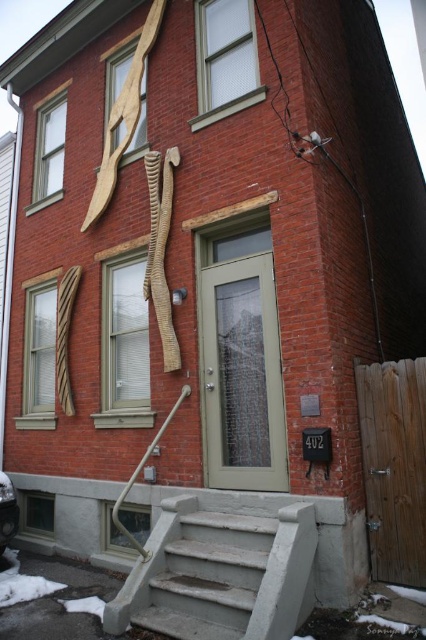
Question: Does concrete steps at center have a larger size compared to brushed metal handrail at lower center?

Choices:
 (A) yes
 (B) no

Answer: (B)

Question: Among these points, which one is farthest from the camera?

Choices:
 (A) (164, 513)
 (B) (186, 387)

Answer: (B)

Question: Which point is farther to the camera?

Choices:
 (A) concrete steps at center
 (B) brushed metal handrail at lower center

Answer: (B)

Question: Does concrete steps at center have a larger size compared to brushed metal handrail at lower center?

Choices:
 (A) no
 (B) yes

Answer: (A)

Question: Where is concrete steps at center located in relation to brushed metal handrail at lower center in the image?

Choices:
 (A) above
 (B) below

Answer: (B)